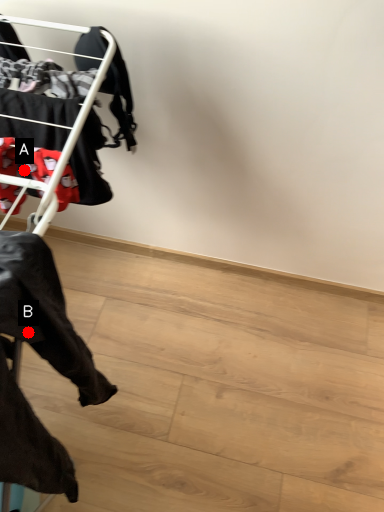
Question: Two points are circled on the image, labeled by A and B beside each circle. Which point appears farthest from the camera in this image?

Choices:
 (A) A is further
 (B) B is further

Answer: (A)